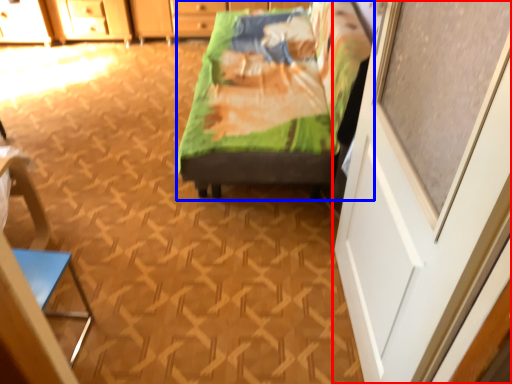
Question: Among these objects, which one is farthest to the camera, screen door (highlighted by a red box) or furniture (highlighted by a blue box)?

Choices:
 (A) screen door
 (B) furniture

Answer: (B)